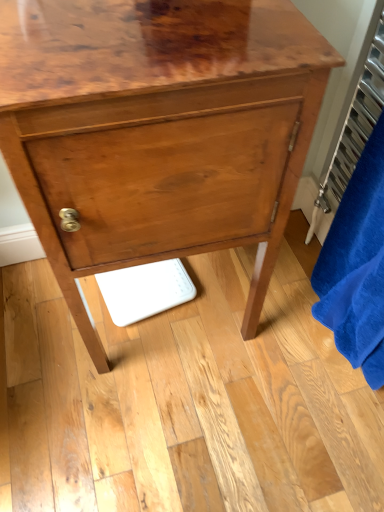
You are a GUI agent. You are given a task and a screenshot of the screen. Output one action in this format:
    pyautogui.click(x=<x>, y=<y>)
    Task: Click on the vacant area that lies to the right of glossy wood chest of drawers at center
    Image resolution: width=384 pixels, height=512 pixels.
    Given the screenshot: What is the action you would take?
    pyautogui.click(x=296, y=334)